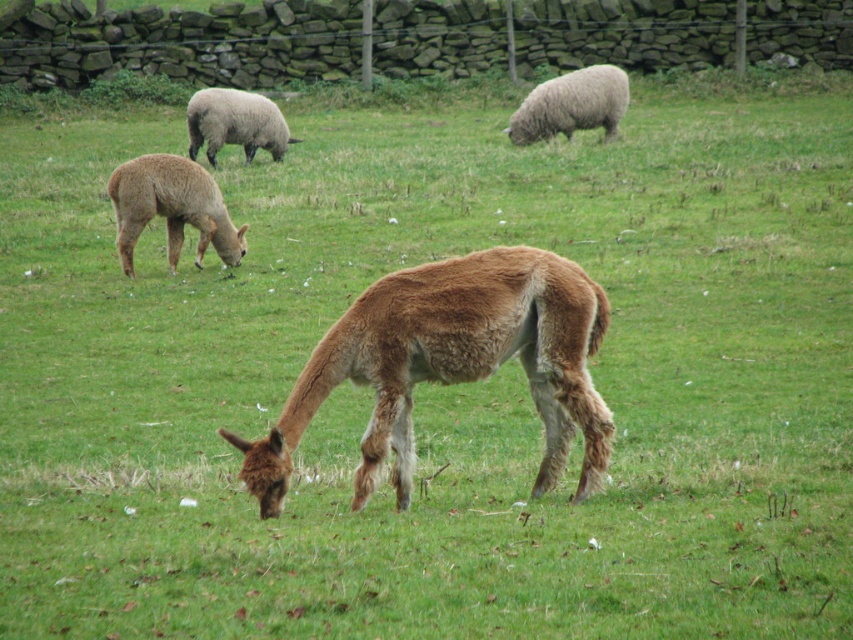
Question: Is the position of brown woolen sheep at left less distant than that of white woolly sheep at upper center?

Choices:
 (A) no
 (B) yes

Answer: (B)

Question: Which point is closer to the camera?

Choices:
 (A) (198, 102)
 (B) (503, 131)
 (C) (123, 266)
 (D) (289, 449)

Answer: (D)

Question: Which point appears closest to the camera in this image?

Choices:
 (A) (195, 109)
 (B) (550, 273)
 (C) (187, 166)

Answer: (B)

Question: Does brown woolen sheep at left appear on the right side of white woolly sheep at upper center?

Choices:
 (A) yes
 (B) no

Answer: (A)

Question: Is brown woolly alpaca at center positioned at the back of brown woolen sheep at left?

Choices:
 (A) yes
 (B) no

Answer: (B)

Question: Among these points, which one is farthest from the camera?

Choices:
 (A) (144, 193)
 (B) (189, 154)
 (C) (532, 88)
 (D) (277, 470)

Answer: (C)